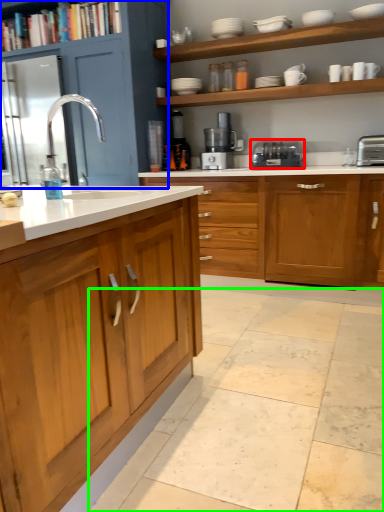
Question: Based on their relative distances, which object is nearer to home appliance (highlighted by a red box)? Choose from cabinetry (highlighted by a blue box) and ceramic tile (highlighted by a green box).

Choices:
 (A) cabinetry
 (B) ceramic tile

Answer: (A)